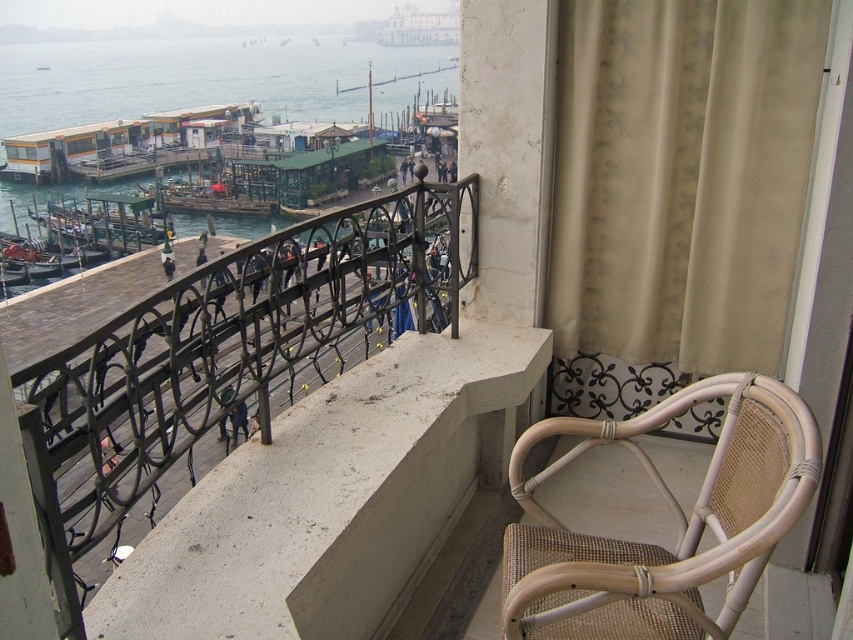
Looking at this image, is wooden gondola at left positioned before clear glass window at upper center?

Yes.

Does wooden gondola at left appear on the right side of clear glass window at upper center?

Yes, wooden gondola at left is to the right of clear glass window at upper center.

At what (x,y) coordinates should I click in order to perform the action: click on wooden gondola at left. Please return your answer as a coordinate pair (x, y). Looking at the image, I should click on (42, 257).

In the scene shown: Is green wooden dock at center to the right of wooden gondola at left from the viewer's perspective?

Incorrect, green wooden dock at center is not on the right side of wooden gondola at left.

Which is behind, point (54, 230) or point (77, 252)?

Positioned behind is point (54, 230).

Describe the element at coordinates (105, 221) in the screenshot. I see `green wooden dock at center` at that location.

This screenshot has height=640, width=853. In order to click on green wooden dock at center in this screenshot , I will do `click(105, 221)`.

From the picture: Is beige fabric curtain at upper right to the left of clear glass window at upper center from the viewer's perspective?

In fact, beige fabric curtain at upper right is to the right of clear glass window at upper center.

Is beige fabric curtain at upper right below clear glass window at upper center?

Yes.

In order to click on beige fabric curtain at upper right in this screenshot , I will do `click(676, 192)`.